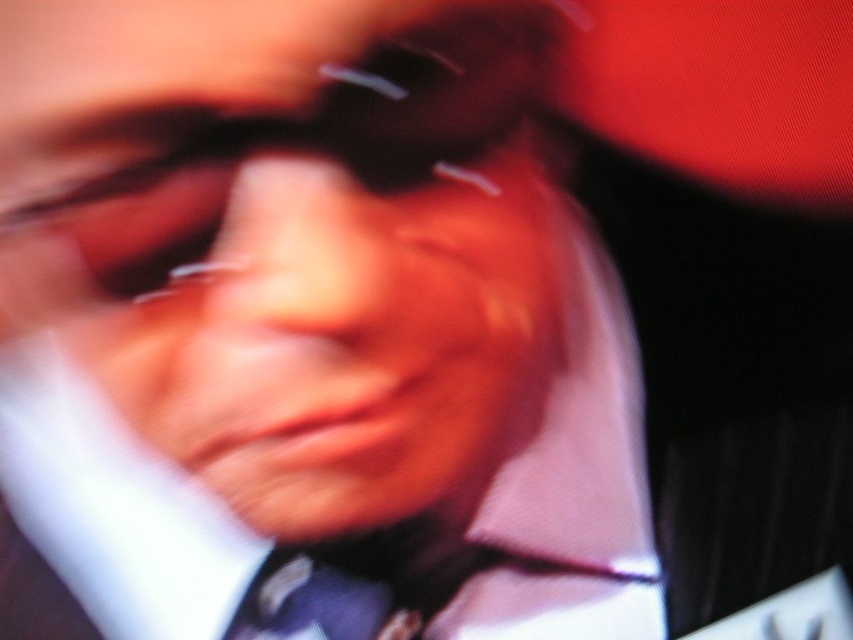
Question: Which point is closer to the camera?

Choices:
 (A) (303, 586)
 (B) (265, 92)

Answer: (B)

Question: In this image, where is matte white face at center located relative to dark blue textured tie at center?

Choices:
 (A) right
 (B) left

Answer: (A)

Question: From the image, what is the correct spatial relationship of matte white face at center in relation to dark blue textured tie at center?

Choices:
 (A) right
 (B) left

Answer: (A)

Question: Which of the following is the farthest from the observer?

Choices:
 (A) dark blue textured tie at center
 (B) matte white face at center

Answer: (A)

Question: Where is matte white face at center located in relation to dark blue textured tie at center in the image?

Choices:
 (A) right
 (B) left

Answer: (A)